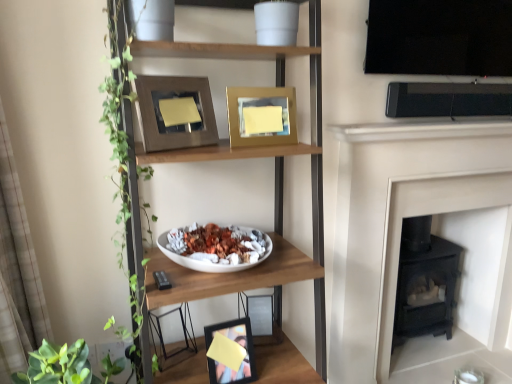
The image size is (512, 384). Find the location of `gold metallic picture frame at upper center, which is the 2th picture frame from top to bottom`. gold metallic picture frame at upper center, which is the 2th picture frame from top to bottom is located at coordinates (261, 116).

Measure the distance between point (262,312) and camera.

The distance of point (262,312) from camera is 5.51 feet.

The image size is (512, 384). In order to click on metallic silver photo frame at lower center, which is the 3th picture frame from top to bottom in this screenshot , I will do `click(261, 318)`.

Describe the element at coordinates (237, 343) in the screenshot. I see `matte black picture frame at lower center, which is the fourth picture frame in top-to-bottom order` at that location.

In order to click on matte black picture frame at lower center, which is the fourth picture frame in top-to-bottom order in this screenshot , I will do `click(237, 343)`.

In order to face wooden shelf at center, should I rotate leftwards or rightwards?

A: You should rotate left by 3.629 degrees.

Find the location of a particular element. wooden frame at upper center, which ranks as the 4th picture frame in bottom-to-top order is located at coordinates (175, 112).

Which object is positioned more to the left, black matte fireplace at right or gold metallic picture frame at upper center, acting as the third picture frame starting from the bottom?

gold metallic picture frame at upper center, acting as the third picture frame starting from the bottom.

Is black matte fireplace at right facing towards gold metallic picture frame at upper center, acting as the third picture frame starting from the bottom?

No, black matte fireplace at right is not facing towards gold metallic picture frame at upper center, acting as the third picture frame starting from the bottom.

Which of these two, black matte fireplace at right or gold metallic picture frame at upper center, acting as the third picture frame starting from the bottom, is wider?

gold metallic picture frame at upper center, acting as the third picture frame starting from the bottom.

Between point (378, 312) and point (280, 331), which one is positioned behind?

Point (378, 312)

Is there a large distance between black matte fireplace at right and metallic silver photo frame at lower center, the 2th picture frame positioned from the bottom?

Actually, black matte fireplace at right and metallic silver photo frame at lower center, the 2th picture frame positioned from the bottom, are a little close together.

How different are the orientations of black matte fireplace at right and metallic silver photo frame at lower center, the 2th picture frame positioned from the bottom, in degrees?

The angular difference between black matte fireplace at right and metallic silver photo frame at lower center, the 2th picture frame positioned from the bottom, is 13 degrees.

Is metallic silver photo frame at lower center, which is the 3th picture frame from top to bottom, at the back of black matte fireplace at right?

No, black matte fireplace at right's orientation is not away from metallic silver photo frame at lower center, which is the 3th picture frame from top to bottom.

Is gold metallic picture frame at upper center, acting as the third picture frame starting from the bottom, oriented towards matte black picture frame at lower center, which is the fourth picture frame in top-to-bottom order?

No, gold metallic picture frame at upper center, acting as the third picture frame starting from the bottom, is not aimed at matte black picture frame at lower center, which is the fourth picture frame in top-to-bottom order.

At what (x,y) coordinates should I click in order to perform the action: click on the 2nd picture frame located beneath the gold metallic picture frame at upper center, acting as the third picture frame starting from the bottom (from a real-world perspective). Please return your answer as a coordinate pair (x, y). Looking at the image, I should click on (237, 343).

Is gold metallic picture frame at upper center, which is the 2th picture frame from top to bottom, surrounding matte black picture frame at lower center, which is the 1th picture frame from bottom to top?

No.

Considering the sizes of black matte fireplace at right and wooden frame at upper center, which ranks as the 4th picture frame in bottom-to-top order, in the image, is black matte fireplace at right bigger or smaller than wooden frame at upper center, which ranks as the 4th picture frame in bottom-to-top order,?

Clearly, black matte fireplace at right is larger in size than wooden frame at upper center, which ranks as the 4th picture frame in bottom-to-top order.

From the image's perspective, is black matte fireplace at right above or below wooden frame at upper center, which ranks as the 4th picture frame in bottom-to-top order?

black matte fireplace at right is situated lower than wooden frame at upper center, which ranks as the 4th picture frame in bottom-to-top order, in the image.

Is there a large distance between black matte fireplace at right and wooden frame at upper center, the 1th picture frame positioned from the top?

Indeed, black matte fireplace at right is not near wooden frame at upper center, the 1th picture frame positioned from the top.

Looking at this image, considering the sizes of objects black matte fireplace at right and wooden frame at upper center, which ranks as the 4th picture frame in bottom-to-top order, in the image provided, who is wider, black matte fireplace at right or wooden frame at upper center, which ranks as the 4th picture frame in bottom-to-top order,?

Wider between the two is wooden frame at upper center, which ranks as the 4th picture frame in bottom-to-top order.

From the image's perspective, which object appears higher, wooden shelf at center or beige fabric curtain at left?

beige fabric curtain at left, from the image's perspective.

Which is in front, point (276, 266) or point (16, 327)?

Point (16, 327)

The height and width of the screenshot is (384, 512). I want to click on shelf below the beige fabric curtain at left (from the image's perspective), so click(x=277, y=86).

Is gold metallic picture frame at upper center, acting as the third picture frame starting from the bottom, aimed at wooden frame at upper center, the 1th picture frame positioned from the top?

No, gold metallic picture frame at upper center, acting as the third picture frame starting from the bottom, is not aimed at wooden frame at upper center, the 1th picture frame positioned from the top.

Is gold metallic picture frame at upper center, which is the 2th picture frame from top to bottom, positioned before wooden frame at upper center, which ranks as the 4th picture frame in bottom-to-top order?

That is False.

Is gold metallic picture frame at upper center, which is the 2th picture frame from top to bottom, next to wooden frame at upper center, the 1th picture frame positioned from the top, and touching it?

gold metallic picture frame at upper center, which is the 2th picture frame from top to bottom, and wooden frame at upper center, the 1th picture frame positioned from the top, are clearly separated.

At what (x,y) coordinates should I click in order to perform the action: click on curtain in front of the matte black picture frame at lower center, which is the 1th picture frame from bottom to top. Please return your answer as a coordinate pair (x, y). Looking at the image, I should click on (17, 272).

Measure the distance from beige fabric curtain at left to matte black picture frame at lower center, which is the 1th picture frame from bottom to top.

A distance of 25.68 inches exists between beige fabric curtain at left and matte black picture frame at lower center, which is the 1th picture frame from bottom to top.

Considering the sizes of objects beige fabric curtain at left and matte black picture frame at lower center, which is the 1th picture frame from bottom to top, in the image provided, who is smaller, beige fabric curtain at left or matte black picture frame at lower center, which is the 1th picture frame from bottom to top,?

With smaller size is matte black picture frame at lower center, which is the 1th picture frame from bottom to top.

Can you tell me how much beige fabric curtain at left and matte black picture frame at lower center, which is the 1th picture frame from bottom to top, differ in facing direction?

There is a 87.5-degree angle between the facing directions of beige fabric curtain at left and matte black picture frame at lower center, which is the 1th picture frame from bottom to top.

Where is `picture frame that is the 1st object located above the black matte fireplace at right (from the image's perspective)`? This screenshot has width=512, height=384. picture frame that is the 1st object located above the black matte fireplace at right (from the image's perspective) is located at coordinates pyautogui.click(x=261, y=116).

At what (x,y) coordinates should I click in order to perform the action: click on picture frame that is the 1st object located in front of the black matte fireplace at right. Please return your answer as a coordinate pair (x, y). Looking at the image, I should click on (261, 318).

Based on their spatial positions, is wooden shelf at center or beige fabric curtain at left closer to gold metallic picture frame at upper center, which is the 2th picture frame from top to bottom?

wooden shelf at center is positioned closer to the anchor gold metallic picture frame at upper center, which is the 2th picture frame from top to bottom.

Looking at the image, which one is located further to gold metallic picture frame at upper center, acting as the third picture frame starting from the bottom, matte black picture frame at lower center, which is the fourth picture frame in top-to-bottom order, or metallic silver photo frame at lower center, the 2th picture frame positioned from the bottom?

matte black picture frame at lower center, which is the fourth picture frame in top-to-bottom order, is further to gold metallic picture frame at upper center, acting as the third picture frame starting from the bottom.

Based on their spatial positions, is gold metallic picture frame at upper center, which is the 2th picture frame from top to bottom, or beige fabric curtain at left closer to wooden shelf at center?

gold metallic picture frame at upper center, which is the 2th picture frame from top to bottom, lies closer to wooden shelf at center than the other object.

Which object lies nearer to the anchor point beige fabric curtain at left, matte black picture frame at lower center, which is the fourth picture frame in top-to-bottom order, or metallic silver photo frame at lower center, which is the 3th picture frame from top to bottom?

matte black picture frame at lower center, which is the fourth picture frame in top-to-bottom order, is closer to beige fabric curtain at left.

Based on their spatial positions, is black matte fireplace at right or gold metallic picture frame at upper center, acting as the third picture frame starting from the bottom, closer to metallic silver photo frame at lower center, the 2th picture frame positioned from the bottom?

Based on the image, gold metallic picture frame at upper center, acting as the third picture frame starting from the bottom, appears to be nearer to metallic silver photo frame at lower center, the 2th picture frame positioned from the bottom.

Estimate the real-world distances between objects in this image. Which object is closer to wooden shelf at center, metallic silver photo frame at lower center, which is the 3th picture frame from top to bottom, or matte black picture frame at lower center, which is the 1th picture frame from bottom to top?

The object closer to wooden shelf at center is matte black picture frame at lower center, which is the 1th picture frame from bottom to top.

When comparing their distances from beige fabric curtain at left, does black matte fireplace at right or wooden frame at upper center, which ranks as the 4th picture frame in bottom-to-top order, seem closer?

wooden frame at upper center, which ranks as the 4th picture frame in bottom-to-top order, is positioned closer to the anchor beige fabric curtain at left.

Looking at the image, which one is located closer to black matte fireplace at right, gold metallic picture frame at upper center, acting as the third picture frame starting from the bottom, or beige fabric curtain at left?

gold metallic picture frame at upper center, acting as the third picture frame starting from the bottom, is closer to black matte fireplace at right.

What are the coordinates of `curtain between wooden frame at upper center, the 1th picture frame positioned from the top, and matte black picture frame at lower center, which is the fourth picture frame in top-to-bottom order, from top to bottom` in the screenshot? It's located at (17, 272).

Locate an element on the screen. The image size is (512, 384). shelf between matte black picture frame at lower center, which is the 1th picture frame from bottom to top, and black matte fireplace at right is located at coordinates (277, 86).

Find the location of `shelf between beige fabric curtain at left and gold metallic picture frame at upper center, which is the 2th picture frame from top to bottom, in the horizontal direction`. shelf between beige fabric curtain at left and gold metallic picture frame at upper center, which is the 2th picture frame from top to bottom, in the horizontal direction is located at coordinates (277, 86).

You are a GUI agent. You are given a task and a screenshot of the screen. Output one action in this format:
    pyautogui.click(x=<x>, y=<y>)
    Task: Click on the shelf between gold metallic picture frame at upper center, which is the 2th picture frame from top to bottom, and metallic silver photo frame at lower center, the 2th picture frame positioned from the bottom, in the vertical direction
    This screenshot has width=512, height=384.
    Given the screenshot: What is the action you would take?
    click(x=277, y=86)